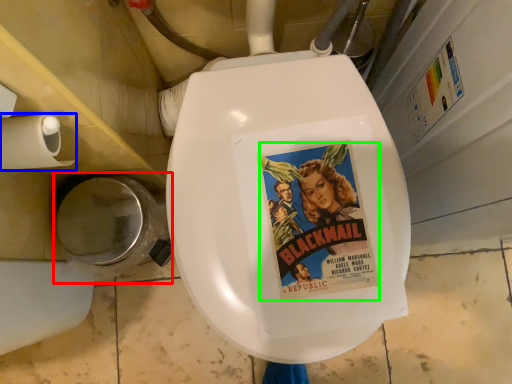
Question: Based on their relative distances, which object is nearer to toilet bowl (highlighted by a red box)? Choose from toilet paper (highlighted by a blue box) and comic book character (highlighted by a green box).

Choices:
 (A) toilet paper
 (B) comic book character

Answer: (A)